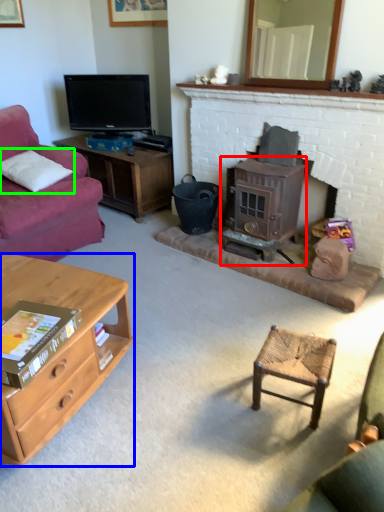
Question: Estimate the real-world distances between objects in this image. Which object is farther from wood burning stove (highlighted by a red box), desk (highlighted by a blue box) or pillow (highlighted by a green box)?

Choices:
 (A) desk
 (B) pillow

Answer: (B)